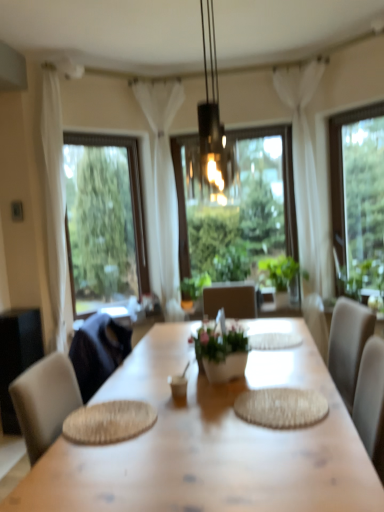
Question: Can you confirm if green leafy plant at right is taller than white sheer curtain at center, which is counted as the 2th curtain, starting from the right?

Choices:
 (A) no
 (B) yes

Answer: (A)

Question: Could white sheer curtain at center, which is counted as the 2th curtain, starting from the right, be considered to be inside green leafy plant at right?

Choices:
 (A) yes
 (B) no

Answer: (B)

Question: Considering the relative sizes of green leafy plant at right and white sheer curtain at center, positioned as the 1th curtain in left-to-right order, in the image provided, is green leafy plant at right bigger than white sheer curtain at center, positioned as the 1th curtain in left-to-right order,?

Choices:
 (A) yes
 (B) no

Answer: (B)

Question: Considering the relative sizes of green leafy plant at right and white sheer curtain at center, positioned as the 1th curtain in left-to-right order, in the image provided, is green leafy plant at right wider than white sheer curtain at center, positioned as the 1th curtain in left-to-right order,?

Choices:
 (A) no
 (B) yes

Answer: (B)

Question: Is white sheer curtain at center, which is counted as the 2th curtain, starting from the right, at the back of green leafy plant at right?

Choices:
 (A) no
 (B) yes

Answer: (A)

Question: Is green leafy plant at right oriented towards white sheer curtain at center, positioned as the 1th curtain in left-to-right order?

Choices:
 (A) yes
 (B) no

Answer: (B)

Question: Considering the relative sizes of clear glass window at left, arranged as the third window when viewed from the right, and green leafy plant at center, which ranks as the first houseplant in right-to-left order, in the image provided, is clear glass window at left, arranged as the third window when viewed from the right, smaller than green leafy plant at center, which ranks as the first houseplant in right-to-left order,?

Choices:
 (A) no
 (B) yes

Answer: (A)

Question: From a real-world perspective, is clear glass window at left, arranged as the third window when viewed from the right, over green leafy plant at center, which appears as the second houseplant when viewed from the front?

Choices:
 (A) yes
 (B) no

Answer: (A)

Question: Is clear glass window at left, arranged as the third window when viewed from the right, wider than green leafy plant at center, the 1th houseplant positioned from the back?

Choices:
 (A) no
 (B) yes

Answer: (A)

Question: From the image's perspective, would you say clear glass window at left, which ranks as the 1th window in left-to-right order, is shown under green leafy plant at center, which ranks as the first houseplant in right-to-left order?

Choices:
 (A) no
 (B) yes

Answer: (A)

Question: Considering the relative positions of clear glass window at left, which ranks as the 1th window in left-to-right order, and green leafy plant at center, which is the second houseplant in left-to-right order, in the image provided, is clear glass window at left, which ranks as the 1th window in left-to-right order, behind green leafy plant at center, which is the second houseplant in left-to-right order,?

Choices:
 (A) yes
 (B) no

Answer: (B)

Question: Is clear glass window at left, which ranks as the 1th window in left-to-right order, beside green leafy plant at center, which appears as the second houseplant when viewed from the front?

Choices:
 (A) no
 (B) yes

Answer: (A)

Question: From the image's perspective, is black glass pendant light at center on top of green leafy plant at center, which ranks as the first houseplant in right-to-left order?

Choices:
 (A) yes
 (B) no

Answer: (A)